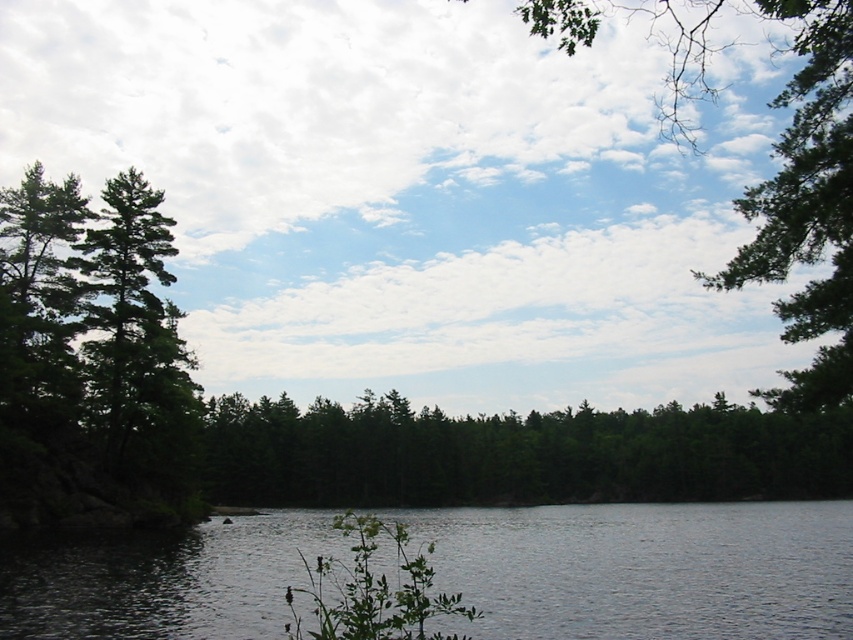
Question: In this image, where is green matte tree at left located relative to green leafy tree at upper right?

Choices:
 (A) above
 (B) below

Answer: (B)

Question: Among these points, which one is nearest to the camera?

Choices:
 (A) (294, 460)
 (B) (62, 620)
 (C) (804, 220)

Answer: (C)

Question: Is smooth gray water at lower left to the left of green matte tree at center from the viewer's perspective?

Choices:
 (A) yes
 (B) no

Answer: (A)

Question: Can you confirm if green matte tree at center is positioned below green leafy tree at upper right?

Choices:
 (A) yes
 (B) no

Answer: (A)

Question: Among these objects, which one is nearest to the camera?

Choices:
 (A) green leafy tree at upper right
 (B) green matte tree at left
 (C) smooth gray water at lower left
 (D) green matte tree at center

Answer: (A)

Question: Estimate the real-world distances between objects in this image. Which object is closer to the green leafy tree at upper right?

Choices:
 (A) green matte tree at center
 (B) green matte tree at left

Answer: (B)